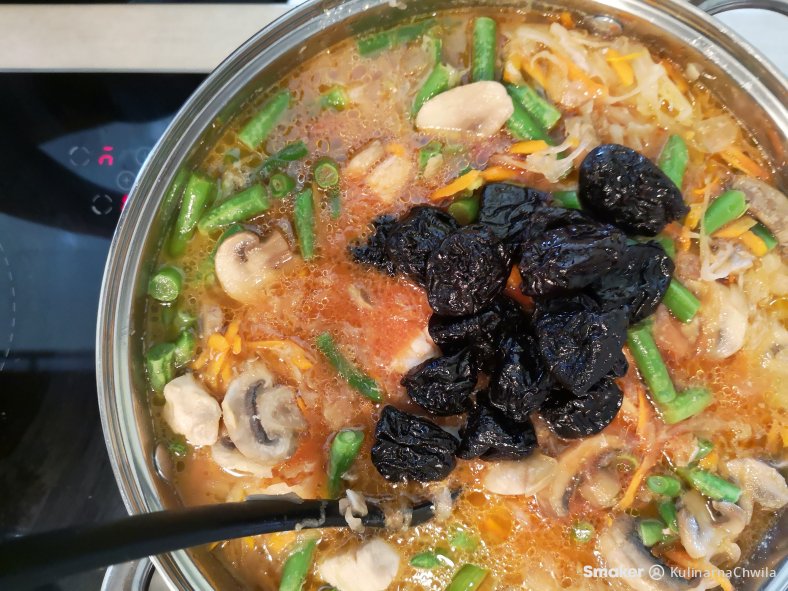
Where is `white bar in background`? This screenshot has height=591, width=788. white bar in background is located at coordinates (132, 38).